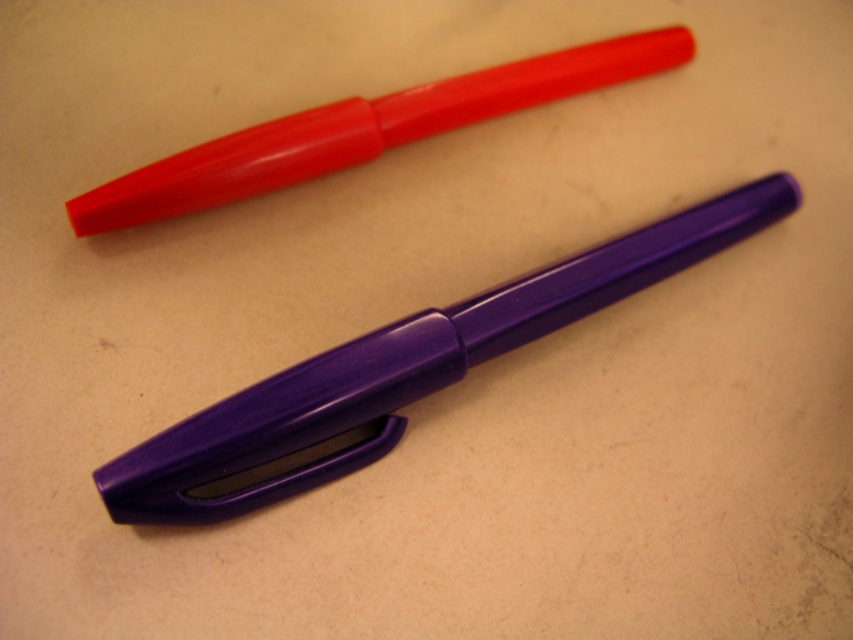
Can you confirm if glossy purple fountain pen at center is wider than matte plastic pen at upper center?

Yes, glossy purple fountain pen at center is wider than matte plastic pen at upper center.

Between point (335, 378) and point (293, 148), which one is positioned behind?

Positioned behind is point (293, 148).

Does point (160, 509) lie in front of point (556, 90)?

Yes, it is.

Where is `glossy purple fountain pen at center`? The width and height of the screenshot is (853, 640). glossy purple fountain pen at center is located at coordinates (399, 372).